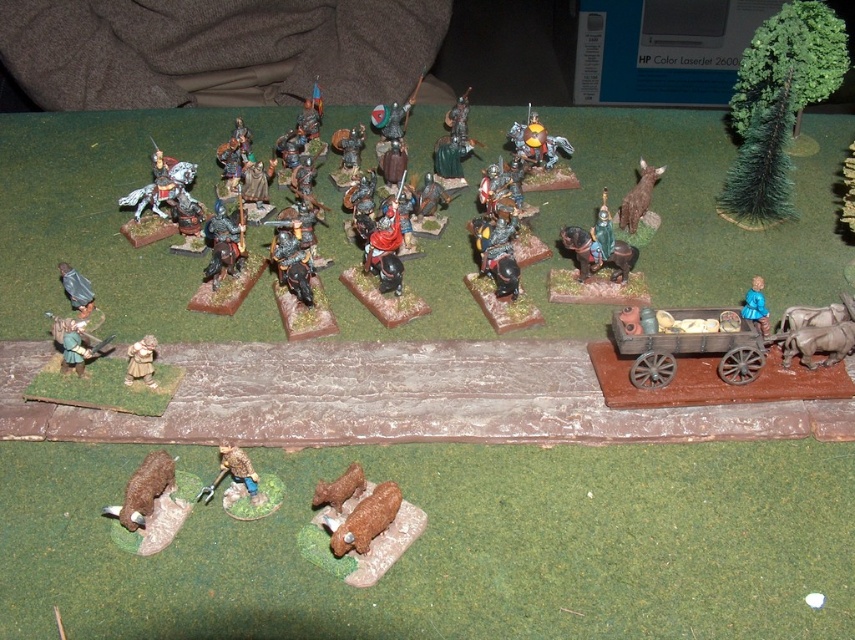
Question: Which point is closer to the camera?

Choices:
 (A) brown leather armor at lower center
 (B) brown matte pig at lower center

Answer: (B)

Question: Does brown matte horse at upper right appear on the left side of green metallic figure at center-right?

Choices:
 (A) no
 (B) yes

Answer: (A)

Question: Considering the real-world distances, which object is farthest from the matte brown leather armor at left?

Choices:
 (A) brown matte cow at lower left
 (B) brown matte pig at lower center
 (C) brown matte horse at upper right

Answer: (C)

Question: Based on their relative distances, which object is nearer to the blue matte figure at right?

Choices:
 (A) brown leather armor at lower center
 (B) wooden cart at lower right

Answer: (B)

Question: Is brown matte figure at lower center smaller than green metallic figure at center-right?

Choices:
 (A) yes
 (B) no

Answer: (B)

Question: From the image, what is the correct spatial relationship of brown matte figure at lower center in relation to brown matte cow at lower center?

Choices:
 (A) right
 (B) left

Answer: (B)